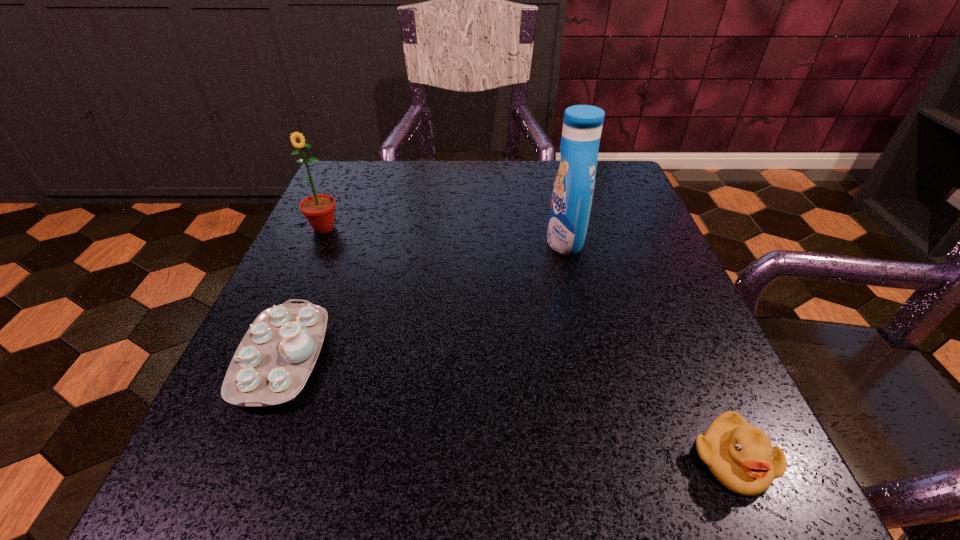
Find the location of a particular element. the tallest object is located at coordinates (573, 188).

Where is `the second object from right to left`? The height and width of the screenshot is (540, 960). the second object from right to left is located at coordinates (573, 188).

Locate an element on the screen. the third shortest object is located at coordinates (319, 210).

I want to click on chinaware, so click(275, 358).

Where is `the rightmost object`? The image size is (960, 540). the rightmost object is located at coordinates (740, 455).

Locate an element on the screen. the nearest object is located at coordinates (740, 455).

Image resolution: width=960 pixels, height=540 pixels. In order to click on vacant area situated on the front-facing side of the tallest object in this screenshot , I will do `click(438, 240)`.

Where is `vacant area located on the front-facing side of the tallest object`? This screenshot has width=960, height=540. vacant area located on the front-facing side of the tallest object is located at coordinates (488, 240).

Locate an element on the screen. vacant space located 0.110m on the front-facing side of the tallest object is located at coordinates (492, 240).

You are a GUI agent. You are given a task and a screenshot of the screen. Output one action in this format:
    pyautogui.click(x=<x>, y=<y>)
    Task: Click on the blank area located 0.400m on the face of the sunflower
    The width and height of the screenshot is (960, 540).
    Given the screenshot: What is the action you would take?
    pyautogui.click(x=239, y=416)